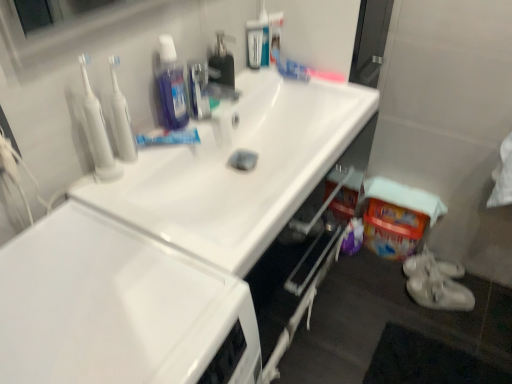
I want to click on free spot in front of white plastic toothbrushes at upper left, the second cleanser from the left, so click(121, 190).